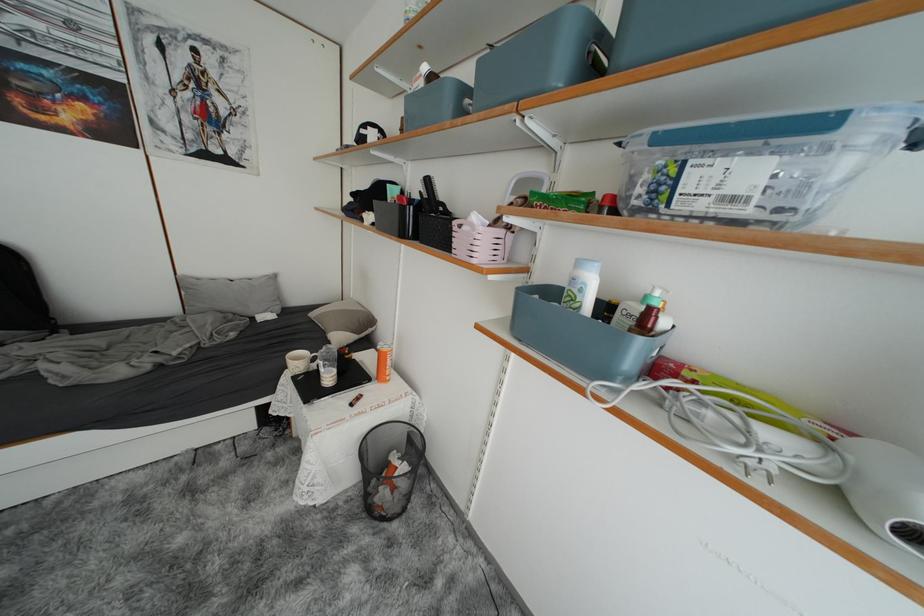
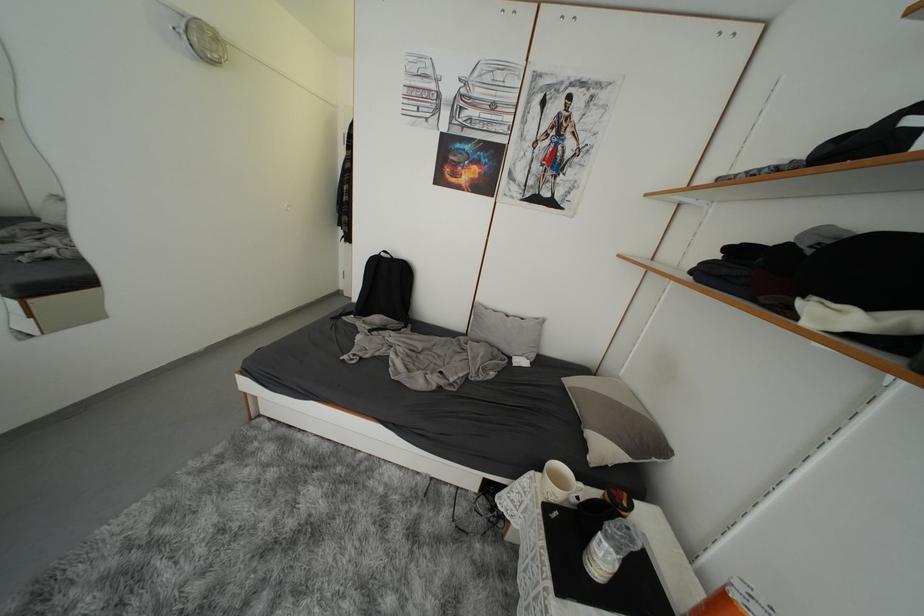
Where in the second image is the point corresponding to the point at 238,281 from the first image?

(516, 315)